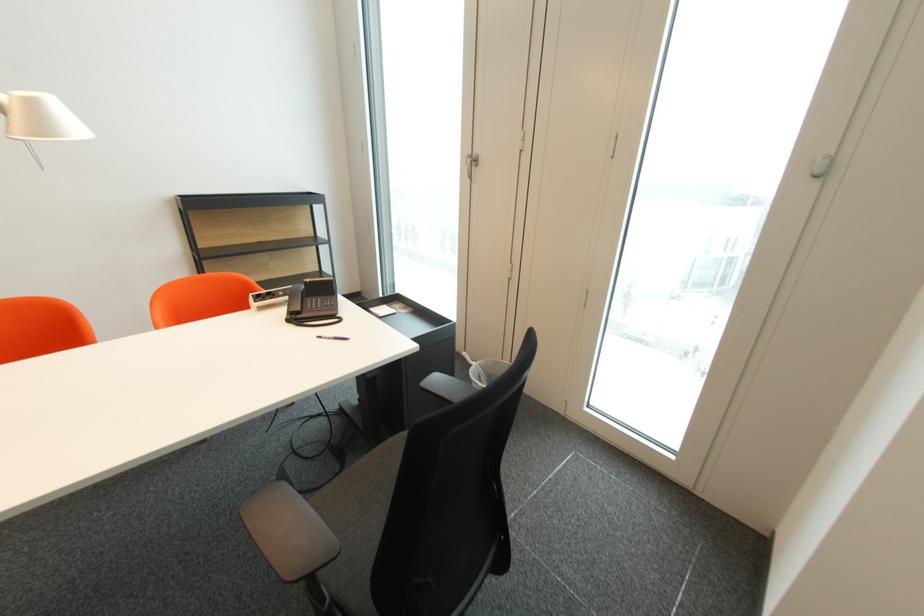
Find where to lift the telephone handset. Please return your answer as a coordinate pair (x, y).

(294, 300)